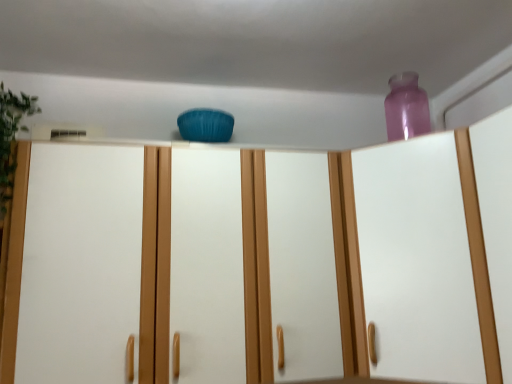
Question: Is green leafy plant at left closer to camera compared to transparent plastic vase at upper right?

Choices:
 (A) yes
 (B) no

Answer: (B)

Question: Considering the relative positions of green leafy plant at left and transparent plastic vase at upper right in the image provided, is green leafy plant at left to the right of transparent plastic vase at upper right from the viewer's perspective?

Choices:
 (A) yes
 (B) no

Answer: (B)

Question: Is green leafy plant at left smaller than transparent plastic vase at upper right?

Choices:
 (A) no
 (B) yes

Answer: (B)

Question: Considering the relative sizes of green leafy plant at left and transparent plastic vase at upper right in the image provided, is green leafy plant at left bigger than transparent plastic vase at upper right?

Choices:
 (A) no
 (B) yes

Answer: (A)

Question: From a real-world perspective, does green leafy plant at left sit lower than transparent plastic vase at upper right?

Choices:
 (A) yes
 (B) no

Answer: (B)

Question: Would you say transparent plastic vase at upper right is to the left or to the right of green leafy plant at left in the picture?

Choices:
 (A) right
 (B) left

Answer: (A)

Question: Relative to green leafy plant at left, is transparent plastic vase at upper right in front or behind?

Choices:
 (A) front
 (B) behind

Answer: (A)

Question: From a real-world perspective, is transparent plastic vase at upper right positioned above or below green leafy plant at left?

Choices:
 (A) above
 (B) below

Answer: (B)

Question: From the image's perspective, is transparent plastic vase at upper right above or below green leafy plant at left?

Choices:
 (A) above
 (B) below

Answer: (B)

Question: From a real-world perspective, relative to transparent plastic vase at upper right, is green leafy plant at left vertically above or below?

Choices:
 (A) above
 (B) below

Answer: (A)

Question: Would you say green leafy plant at left is inside or outside transparent plastic vase at upper right?

Choices:
 (A) inside
 (B) outside

Answer: (B)

Question: Is green leafy plant at left bigger or smaller than transparent plastic vase at upper right?

Choices:
 (A) big
 (B) small

Answer: (B)

Question: In terms of height, does green leafy plant at left look taller or shorter compared to transparent plastic vase at upper right?

Choices:
 (A) tall
 (B) short

Answer: (B)

Question: From the image's perspective, is transparent purple bottle at upper right located above or below matte blue cushion at center?

Choices:
 (A) below
 (B) above

Answer: (B)

Question: Based on their positions, is transparent purple bottle at upper right located to the left or right of matte blue cushion at center?

Choices:
 (A) right
 (B) left

Answer: (A)